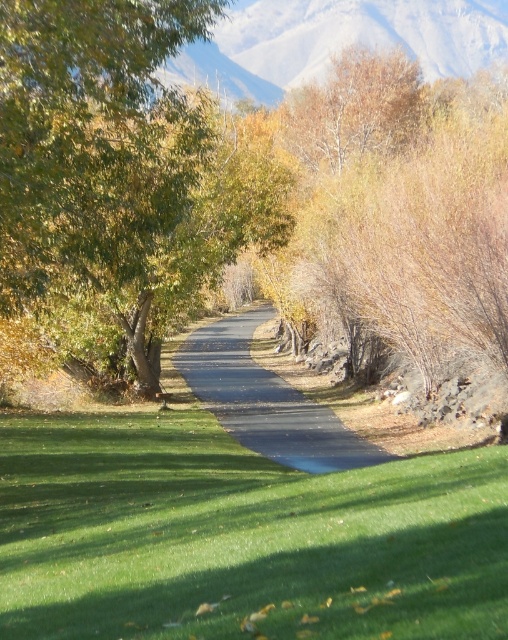
Question: Which object is the closest to the smooth gray mountain at upper center?

Choices:
 (A) green leafy tree at left
 (B) black asphalt road at center

Answer: (A)

Question: Does green grass at center have a smaller size compared to black asphalt road at center?

Choices:
 (A) no
 (B) yes

Answer: (B)

Question: Among these objects, which one is farthest from the camera?

Choices:
 (A) green leafy tree at left
 (B) black asphalt road at center
 (C) smooth gray mountain at upper center
 (D) green grass at center

Answer: (B)

Question: Does smooth gray mountain at upper center come in front of black asphalt road at center?

Choices:
 (A) no
 (B) yes

Answer: (B)

Question: Which of the following is the closest to the observer?

Choices:
 (A) green leafy tree at left
 (B) green grass at center

Answer: (B)

Question: Does green grass at center lie behind green leafy tree at left?

Choices:
 (A) yes
 (B) no

Answer: (B)